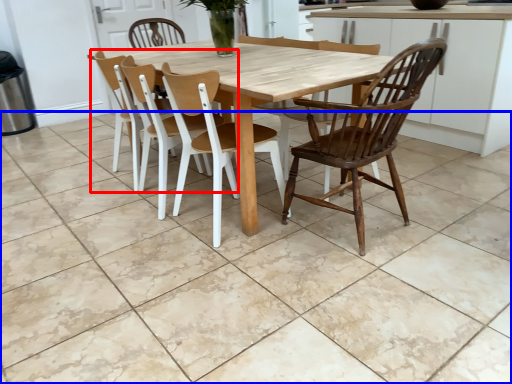
Question: Which of the following is the closest to the observer, chair (highlighted by a red box) or tile (highlighted by a blue box)?

Choices:
 (A) chair
 (B) tile

Answer: (B)